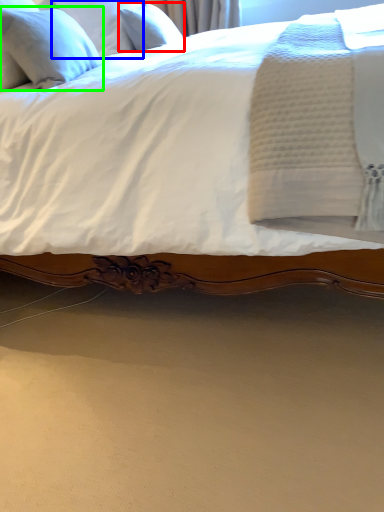
Question: Estimate the real-world distances between objects in this image. Which object is closer to pillow (highlighted by a red box), pillow (highlighted by a blue box) or pillow (highlighted by a green box)?

Choices:
 (A) pillow
 (B) pillow

Answer: (A)